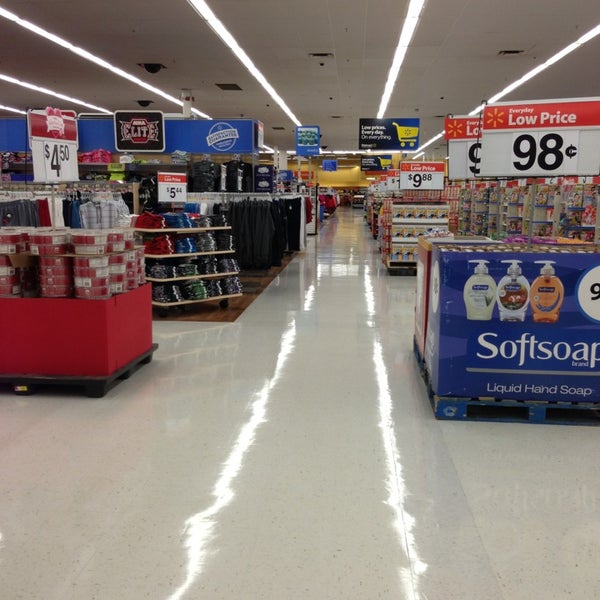
Where is `light`? The height and width of the screenshot is (600, 600). light is located at coordinates (240, 73).